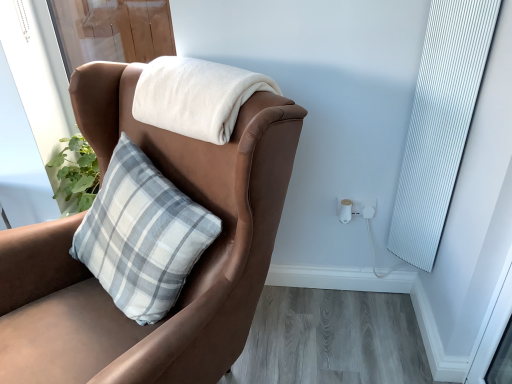
Find the location of a particular element. white soft blanket at upper center is located at coordinates (195, 96).

The height and width of the screenshot is (384, 512). Identify the location of brown leather chair at upper left. (191, 272).

What is the approximate height of brown leather chair at upper left?

brown leather chair at upper left is 3.33 feet in height.

Measure the distance between point (371,201) and camera.

Point (371,201) and camera are 1.62 meters apart.

The width and height of the screenshot is (512, 384). I want to click on white soft blanket at upper center, so click(x=195, y=96).

From a real-world perspective, is white soft blanket at upper center physically located above or below brown leather chair at upper left?

From a real-world perspective, white soft blanket at upper center is physically above brown leather chair at upper left.

Are white soft blanket at upper center and brown leather chair at upper left located far from each other?

No, white soft blanket at upper center is in close proximity to brown leather chair at upper left.

Consider the image. From the image's perspective, between white soft blanket at upper center and brown leather chair at upper left, who is located below?

brown leather chair at upper left.

In terms of height, does white soft blanket at upper center look taller or shorter compared to brown leather chair at upper left?

white soft blanket at upper center is shorter than brown leather chair at upper left.

Does white soft blanket at upper center have a greater height compared to white ribbed curtain at right?

No.

From the image's perspective, is white soft blanket at upper center above or below white ribbed curtain at right?

→ Based on their image positions, white soft blanket at upper center is located above white ribbed curtain at right.

Is white soft blanket at upper center in contact with white ribbed curtain at right?

→ white soft blanket at upper center and white ribbed curtain at right are clearly separated.

Can you confirm if white soft blanket at upper center is bigger than white ribbed curtain at right?

Indeed, white soft blanket at upper center has a larger size compared to white ribbed curtain at right.

Are white ribbed curtain at right and brown leather chair at upper left beside each other?

No.

Considering their positions, is white ribbed curtain at right located in front of or behind brown leather chair at upper left?

white ribbed curtain at right is positioned farther from the viewer than brown leather chair at upper left.

Is white ribbed curtain at right bigger or smaller than brown leather chair at upper left?

Clearly, white ribbed curtain at right is smaller in size than brown leather chair at upper left.

Choose the correct answer: Is white ribbed curtain at right inside brown leather chair at upper left or outside it?

white ribbed curtain at right is spatially situated outside brown leather chair at upper left.

From the image's perspective, which is above, white soft blanket at upper center or white plastic electric outlet at lower right?

white soft blanket at upper center is shown above in the image.

From a real-world perspective, is white soft blanket at upper center under white plastic electric outlet at lower right?

No, from a real-world perspective, white soft blanket at upper center is not below white plastic electric outlet at lower right.

Identify the location of blanket on the left of the white plastic electric outlet at lower right. This screenshot has width=512, height=384. (195, 96).

Is there a large distance between white soft blanket at upper center and white plastic electric outlet at lower right?

They are positioned close to each other.

Between white plastic electric outlet at lower right and white ribbed curtain at right, which one is positioned in front?

white ribbed curtain at right is more forward.

The height and width of the screenshot is (384, 512). In order to click on electric outlet on the left of white ribbed curtain at right in this screenshot , I will do `click(355, 208)`.

Who is shorter, white plastic electric outlet at lower right or white ribbed curtain at right?

white plastic electric outlet at lower right.

From the image's perspective, is white plastic electric outlet at lower right positioned above or below white ribbed curtain at right?

white plastic electric outlet at lower right is situated lower than white ribbed curtain at right in the image.

In the scene shown: Which object is further away from the camera, white plastic electric outlet at lower right or white soft blanket at upper center?

white plastic electric outlet at lower right.

Is white plastic electric outlet at lower right placed right next to white soft blanket at upper center?

white plastic electric outlet at lower right and white soft blanket at upper center are not in contact.

Considering the relative sizes of white plastic electric outlet at lower right and white soft blanket at upper center in the image provided, is white plastic electric outlet at lower right taller than white soft blanket at upper center?

In fact, white plastic electric outlet at lower right may be shorter than white soft blanket at upper center.

Is white plastic electric outlet at lower right to the right of white soft blanket at upper center from the viewer's perspective?

Indeed, white plastic electric outlet at lower right is positioned on the right side of white soft blanket at upper center.

Is white plastic electric outlet at lower right shorter than brown leather chair at upper left?

Correct, white plastic electric outlet at lower right is not as tall as brown leather chair at upper left.

From the image's perspective, which one is positioned lower, white plastic electric outlet at lower right or brown leather chair at upper left?

brown leather chair at upper left is shown below in the image.

Is point (339, 212) closer or farther from the camera than point (233, 348)?

Point (339, 212) is positioned farther from the camera compared to point (233, 348).

This screenshot has width=512, height=384. What are the coordinates of `chair below the white soft blanket at upper center (from the image's perspective)` in the screenshot? It's located at (191, 272).

This screenshot has width=512, height=384. In the image, there is a white ribbed curtain at right. Identify the location of blanket above it (from the image's perspective). (195, 96).

Considering their positions, is white ribbed curtain at right positioned further to brown leather chair at upper left than white plastic electric outlet at lower right?

white ribbed curtain at right lies further to brown leather chair at upper left than the other object.

Which object lies nearer to the anchor point brown leather chair at upper left, white plastic electric outlet at lower right or white soft blanket at upper center?

white soft blanket at upper center is positioned closer to the anchor brown leather chair at upper left.

Looking at the image, which one is located closer to white plastic electric outlet at lower right, white soft blanket at upper center or white ribbed curtain at right?

white ribbed curtain at right is closer to white plastic electric outlet at lower right.

When comparing their distances from white plastic electric outlet at lower right, does white ribbed curtain at right or brown leather chair at upper left seem further?

brown leather chair at upper left.

Which object lies further to the anchor point white plastic electric outlet at lower right, white soft blanket at upper center or brown leather chair at upper left?

brown leather chair at upper left.

When comparing their distances from white ribbed curtain at right, does brown leather chair at upper left or white soft blanket at upper center seem further?

brown leather chair at upper left.

When comparing their distances from brown leather chair at upper left, does white ribbed curtain at right or white soft blanket at upper center seem further?

white ribbed curtain at right lies further to brown leather chair at upper left than the other object.

Based on their spatial positions, is white plastic electric outlet at lower right or brown leather chair at upper left closer to white ribbed curtain at right?

white plastic electric outlet at lower right lies closer to white ribbed curtain at right than the other object.

The image size is (512, 384). I want to click on electric outlet between white soft blanket at upper center and white ribbed curtain at right from left to right, so click(x=355, y=208).

The height and width of the screenshot is (384, 512). I want to click on curtain between brown leather chair at upper left and white plastic electric outlet at lower right from front to back, so click(x=440, y=124).

I want to click on blanket positioned between brown leather chair at upper left and white plastic electric outlet at lower right from near to far, so click(195, 96).

At what (x,y) coordinates should I click in order to perform the action: click on blanket between brown leather chair at upper left and white ribbed curtain at right from left to right. Please return your answer as a coordinate pair (x, y). The height and width of the screenshot is (384, 512). Looking at the image, I should click on (195, 96).